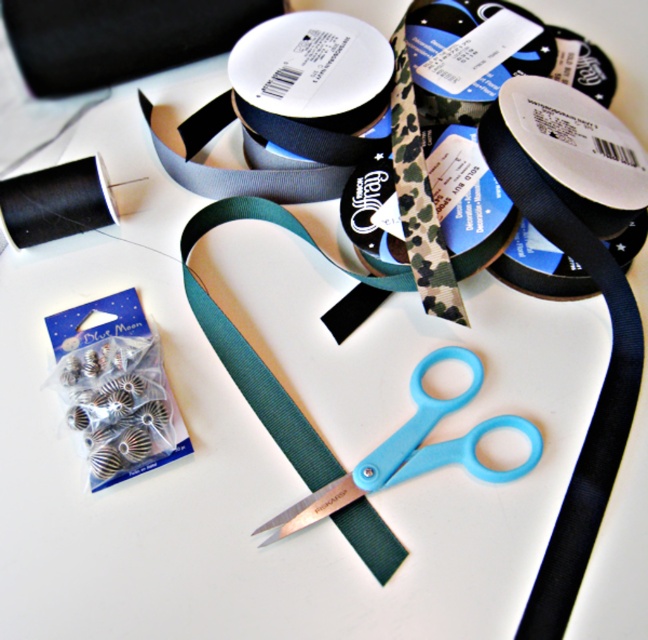
Question: Which point is farther from the camera taking this photo?

Choices:
 (A) (378, 106)
 (B) (469, 193)
 (C) (516, 35)

Answer: (C)

Question: Considering the relative positions of blue plastic scissors at center and black matte thread at upper left in the image provided, where is blue plastic scissors at center located with respect to black matte thread at upper left?

Choices:
 (A) below
 (B) above

Answer: (A)

Question: Is matte black ribbon at upper center positioned before camo fabric tape at center?

Choices:
 (A) yes
 (B) no

Answer: (B)

Question: Which point is closer to the camera taking this photo?

Choices:
 (A) (437, 51)
 (B) (388, 170)
 (C) (614, 237)

Answer: (C)

Question: Does black matte ribbon at upper right appear over matte black ribbon at upper center?

Choices:
 (A) no
 (B) yes

Answer: (A)

Question: Which point appears closest to the camera in this image?

Choices:
 (A) (640, 166)
 (B) (456, 358)

Answer: (B)